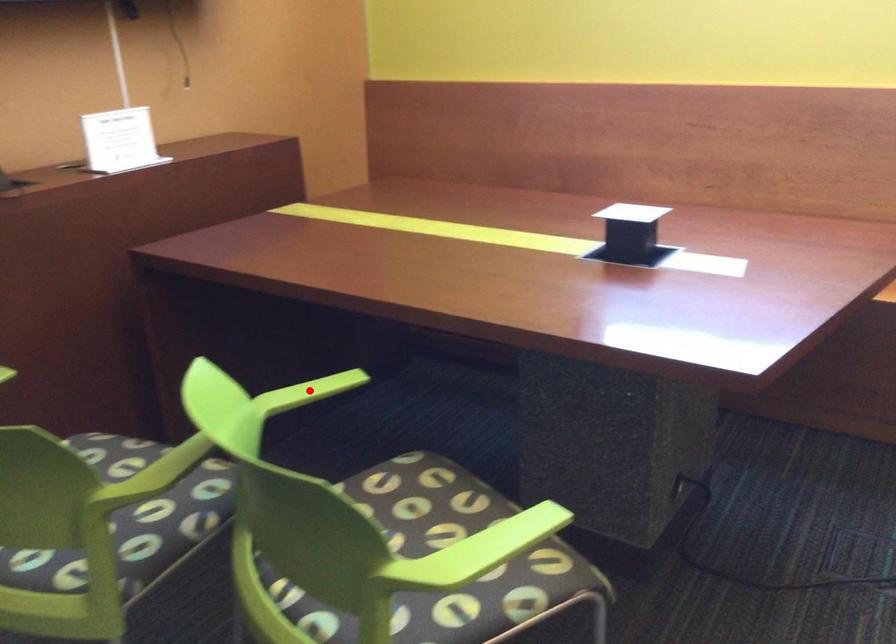
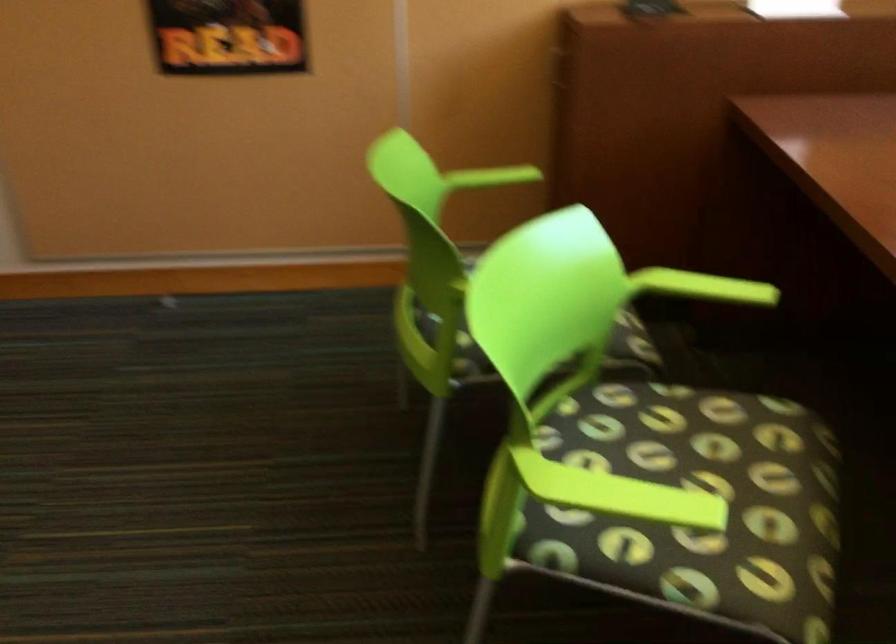
Where in the second image is the point corresponding to the highlighted location from the first image?

(702, 287)